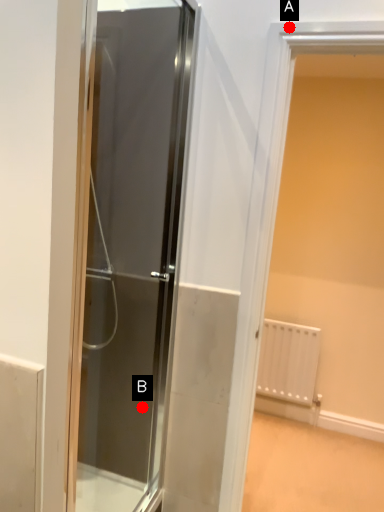
Question: Two points are circled on the image, labeled by A and B beside each circle. Among these points, which one is farthest from the camera?

Choices:
 (A) A is further
 (B) B is further

Answer: (B)